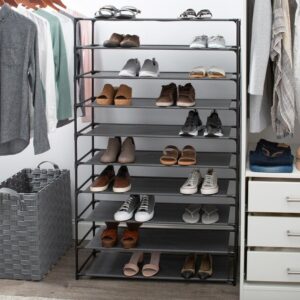
Locate an element on the screen. The height and width of the screenshot is (300, 300). racks is located at coordinates (163, 278), (212, 251), (174, 227), (168, 194), (220, 163), (158, 136), (144, 103), (178, 77), (172, 49), (162, 19).